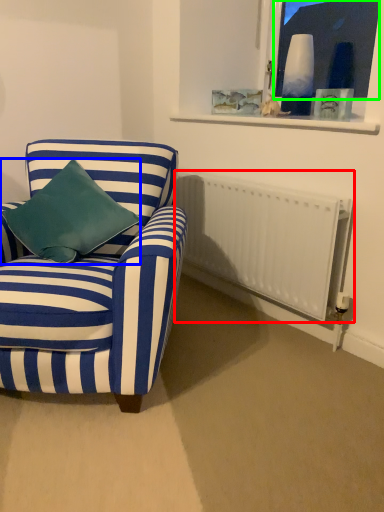
Question: Estimate the real-world distances between objects in this image. Which object is farther from radiator (highlighted by a red box), pillow (highlighted by a blue box) or window screen (highlighted by a green box)?

Choices:
 (A) pillow
 (B) window screen

Answer: (B)